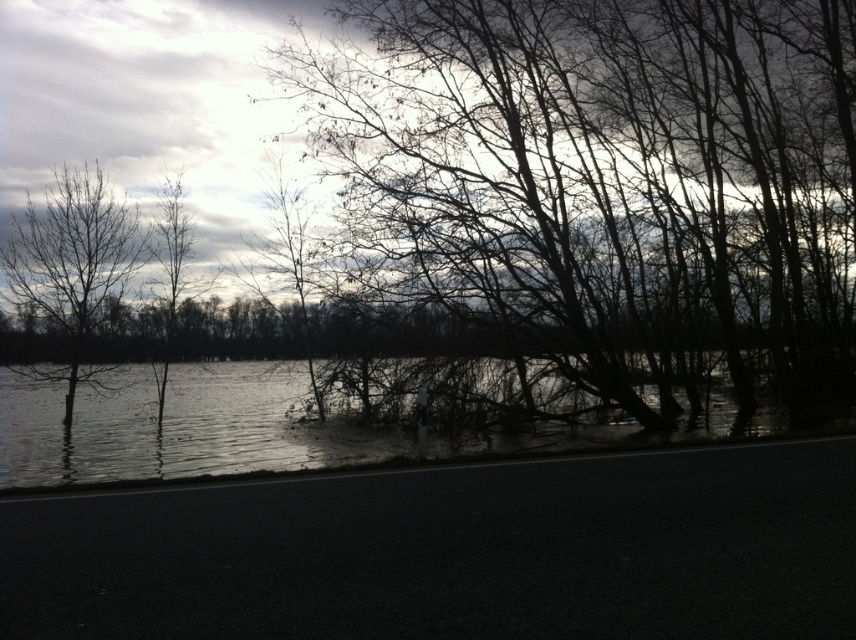
Question: Which of the following is the closest to the observer?

Choices:
 (A) (78, 321)
 (B) (324, 134)
 (C) (221, 397)
 (D) (170, 336)

Answer: (B)

Question: Among these objects, which one is farthest from the camera?

Choices:
 (A) dark reflective water at lower left
 (B) bare branches at center
 (C) silvery bark tree at upper left
 (D) bare branches at left

Answer: (C)

Question: Can you confirm if dark reflective water at lower left is positioned below bare branches at left?

Choices:
 (A) no
 (B) yes

Answer: (B)

Question: Can you confirm if bare branches at left is smaller than silvery bark tree at upper left?

Choices:
 (A) yes
 (B) no

Answer: (B)

Question: Is dark reflective water at lower left wider than bare branches at left?

Choices:
 (A) yes
 (B) no

Answer: (A)

Question: Which of the following is the farthest from the observer?

Choices:
 (A) (94, 196)
 (B) (167, 330)
 (C) (581, 348)

Answer: (B)